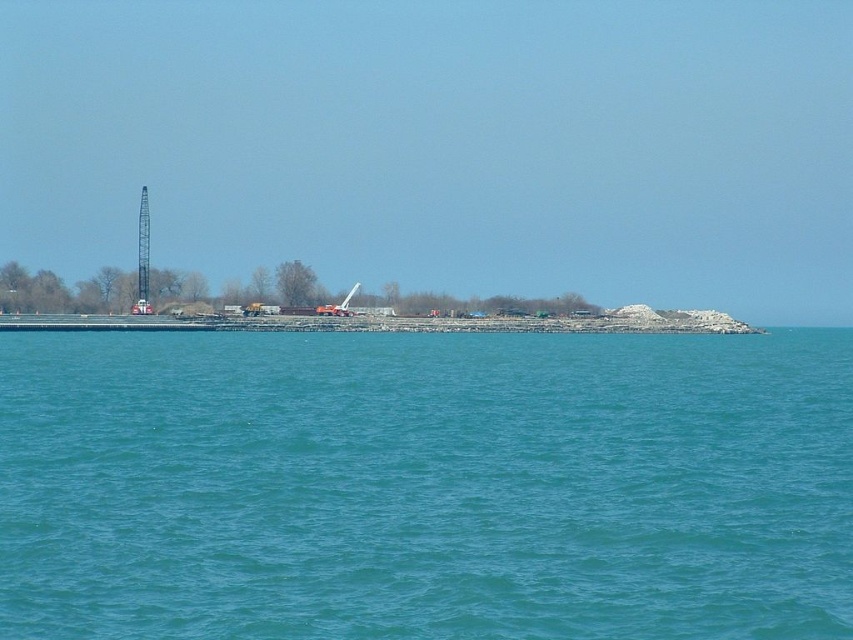
You are a construction worker standing on the strip of land. You need to determine if the blue water at center will reach the base of the metallic crane at center during high tide. Based on their heights, can the water potentially cover the crane base?

The blue water at center is shorter than the metallic crane at center. Since the water is currently lower, it might not reach the crane base during high tide unless the tide rises significantly beyond its current level.

You are a construction inspector tasked with ensuring equipment safety. You observe the metallic gray crane at left and the metallic crane at center from a boat anchored in the turquoise water. Which crane has a larger footprint on the construction site?

Result: The metallic gray crane at left might be wider than metallic crane at center, so it likely has a larger footprint on the construction site.